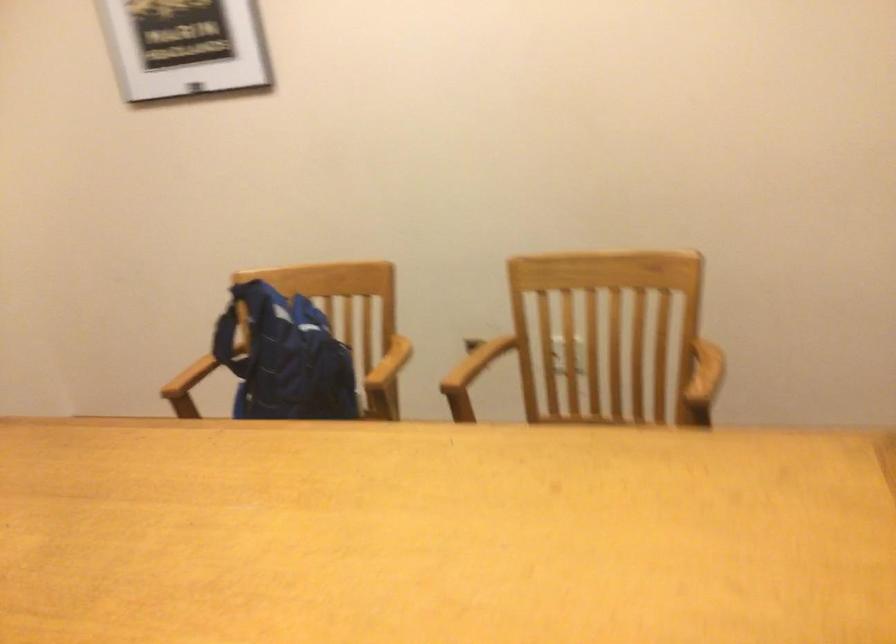
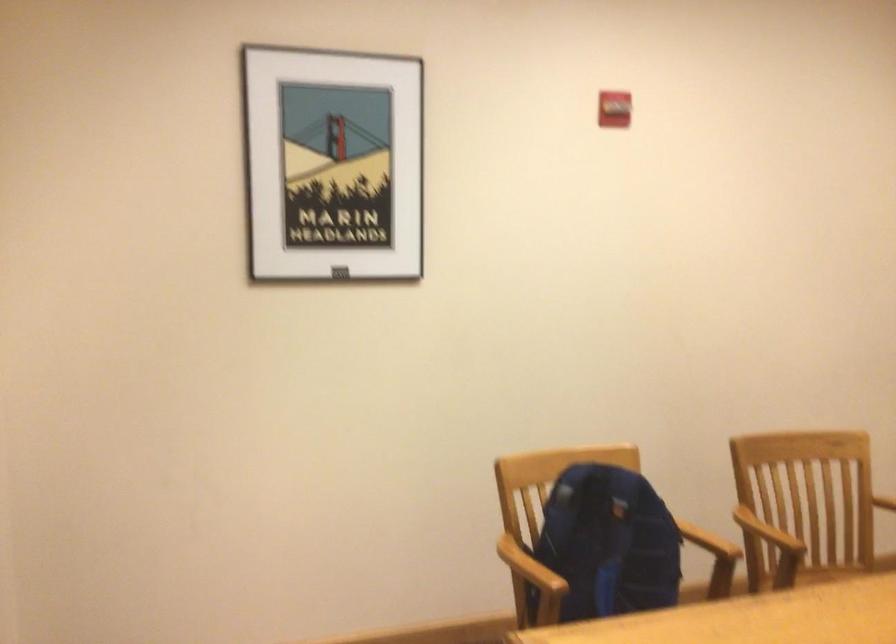
The point at (625, 417) is marked in the first image. Where is the corresponding point in the second image?

(837, 572)